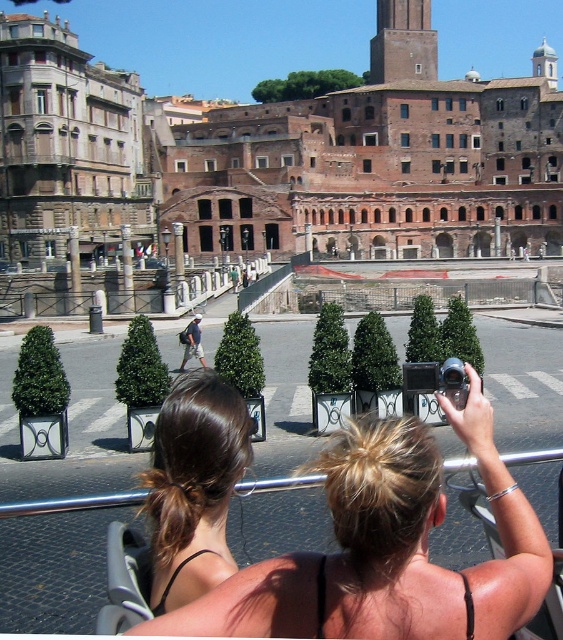
You are standing at the point with coordinates point [203,364] and want to walk to the point with coordinates point [203,561]. Which direction should you move in?

You should move forward because point [203,561] is in front of point [203,364].

You are a photographer standing in the square and notice the blonde hair at upper center and the denim shorts at center. Which object is closer to you?

The blonde hair at upper center is closer to you because it is in front of the denim shorts at center.